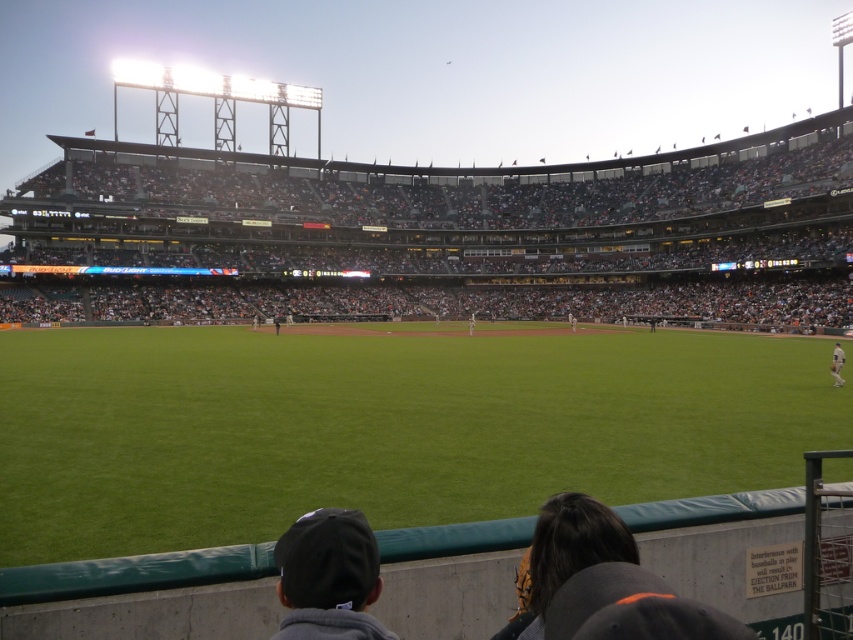
Question: Can you confirm if green grass at center is positioned above dark gray fabric cap at lower center?

Choices:
 (A) no
 (B) yes

Answer: (A)

Question: Is dark gray fabric cap at lower center smaller than white jersey at center?

Choices:
 (A) yes
 (B) no

Answer: (A)

Question: Which point is farther to the camera?

Choices:
 (A) green grass at center
 (B) white jersey at center
 (C) dark gray fabric cap at lower center
 (D) white uniform at center

Answer: (D)

Question: Which object appears closest to the camera in this image?

Choices:
 (A) dark gray fabric cap at lower center
 (B) green grass at center
 (C) white jersey at center
 (D) white uniform at center

Answer: (A)

Question: Can you confirm if green grass at center is positioned above white uniform at center?

Choices:
 (A) yes
 (B) no

Answer: (B)

Question: Which of the following is the farthest from the observer?

Choices:
 (A) white uniform at center
 (B) green grass at center

Answer: (A)